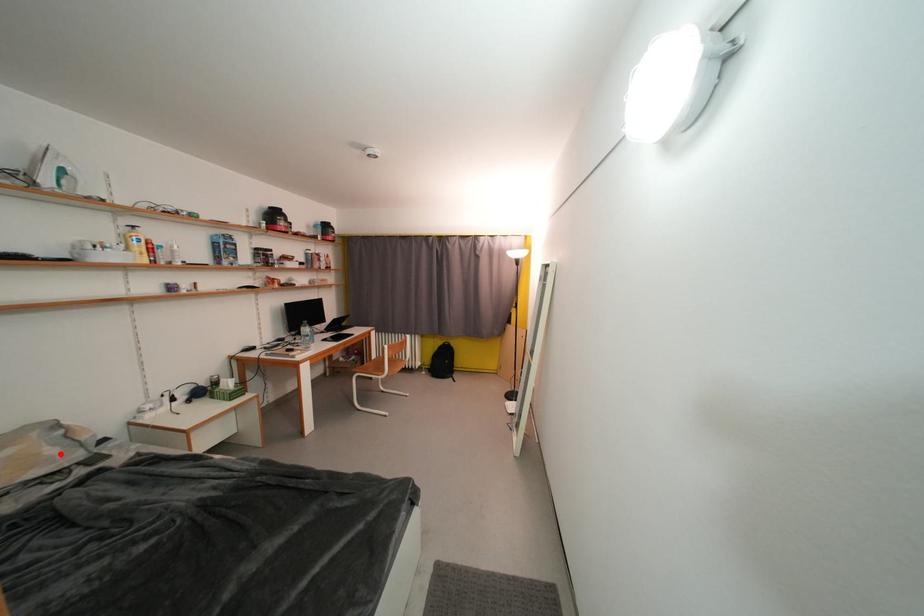
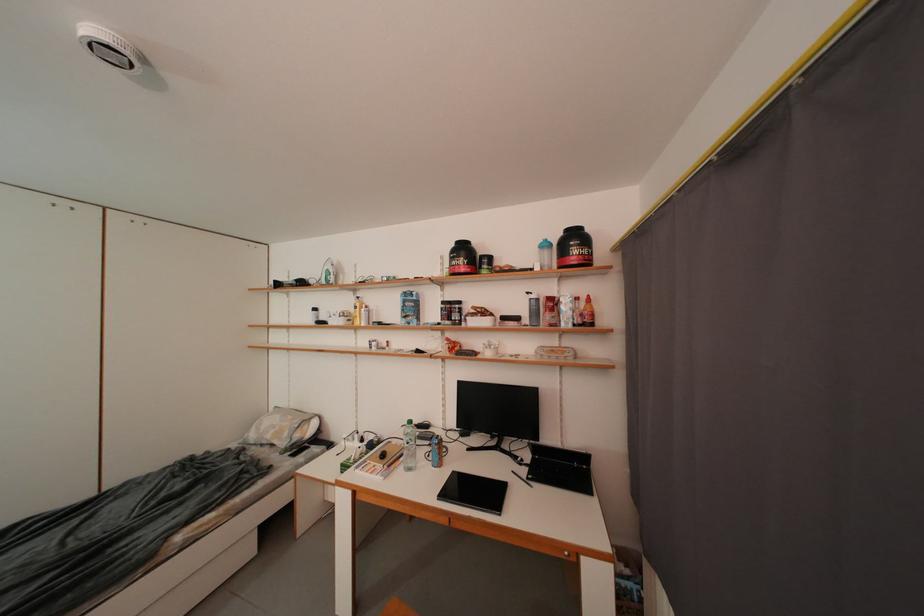
Locate, in the second image, the point that corresponds to the highlighted location in the first image.

(294, 438)